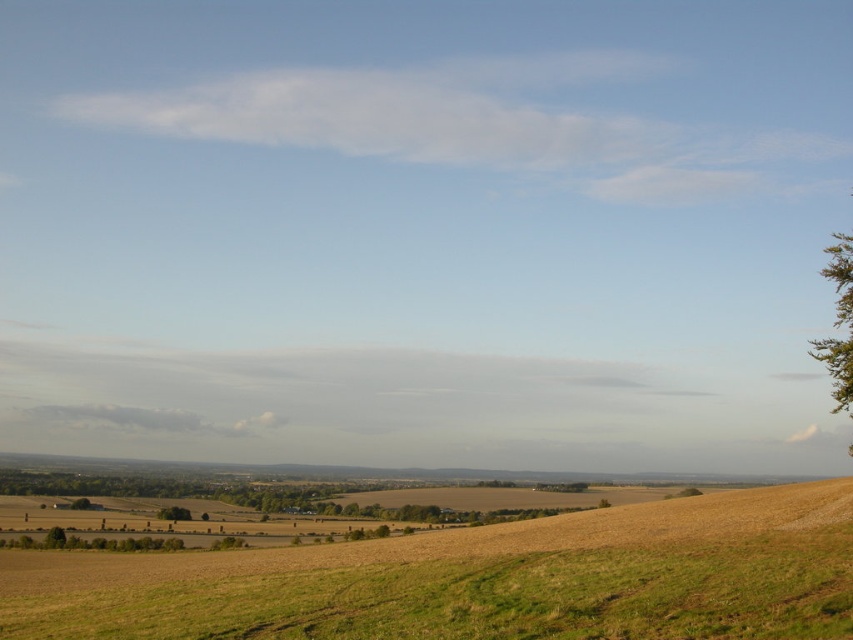
You are standing on the hill in the foreground and want to walk towards the green leafy tree at lower left. Is the green grassy field at lower center between you and the tree?

The green grassy field at lower center is located above the green leafy tree at lower left, so the field is not between you and the tree. You can walk directly towards the tree without going through the field.

You are a farmer checking the growth of your crops. You notice the green grassy field at lower center and the green leafy tree at lower left. Which one has a greater height?

The green grassy field at lower center is much taller than the green leafy tree at lower left.